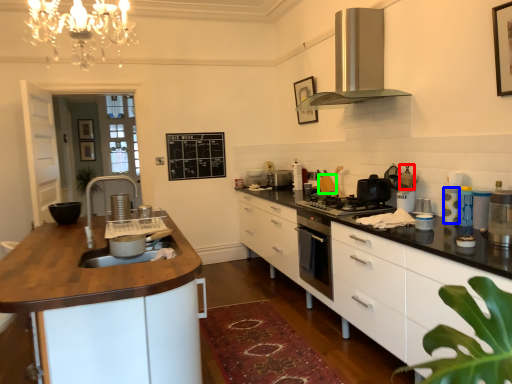
Question: Which object is the farthest from appliance (highlighted by a red box)? Choose among these: appliance (highlighted by a blue box) or appliance (highlighted by a green box).

Choices:
 (A) appliance
 (B) appliance

Answer: (B)